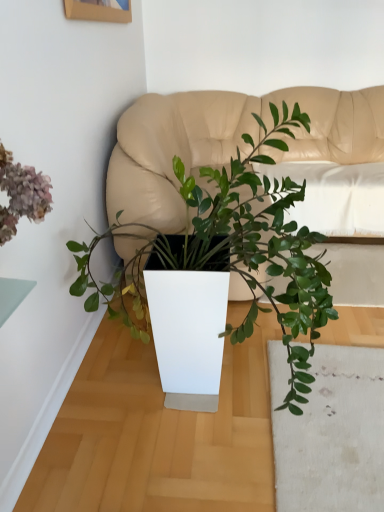
Question: Visually, is matte beige couch at center positioned to the left or to the right of green matte plant at center?

Choices:
 (A) right
 (B) left

Answer: (A)

Question: Is matte beige couch at center in front of or behind green matte plant at center in the image?

Choices:
 (A) front
 (B) behind

Answer: (B)

Question: Looking at their shapes, would you say matte beige couch at center is wider or thinner than green matte plant at center?

Choices:
 (A) thin
 (B) wide

Answer: (B)

Question: Is green matte plant at center wider or thinner than matte beige couch at center?

Choices:
 (A) wide
 (B) thin

Answer: (B)

Question: In the image, is green matte plant at center positioned in front of or behind matte beige couch at center?

Choices:
 (A) behind
 (B) front

Answer: (B)

Question: From the image's perspective, is green matte plant at center above or below matte beige couch at center?

Choices:
 (A) above
 (B) below

Answer: (B)

Question: Do you think green matte plant at center is within matte beige couch at center, or outside of it?

Choices:
 (A) inside
 (B) outside

Answer: (B)